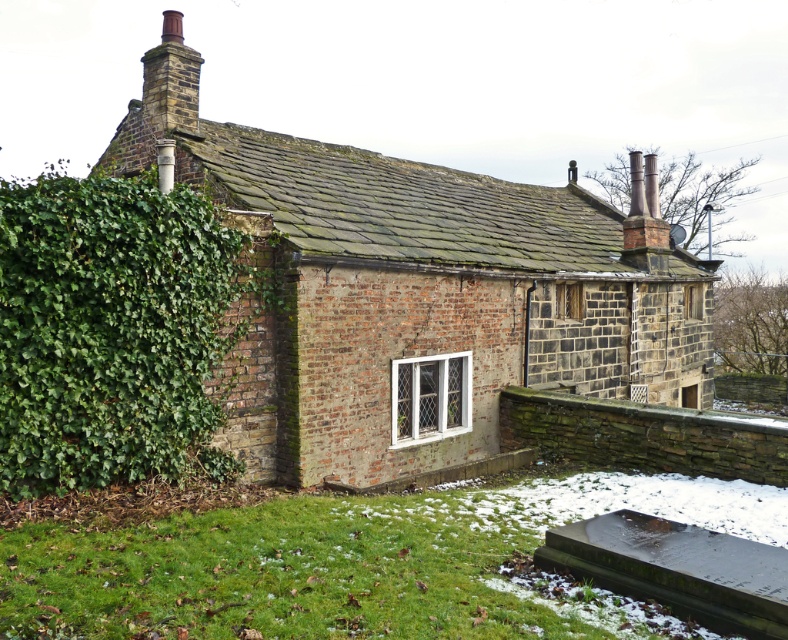
You are a painter who wants to paint both the brown brick cottage at center and the green leafy hedge at left. Which object should you paint first if you want to start with the larger one?

The brown brick cottage at center is bigger than the green leafy hedge at left, so you should paint the brown brick cottage at center first.